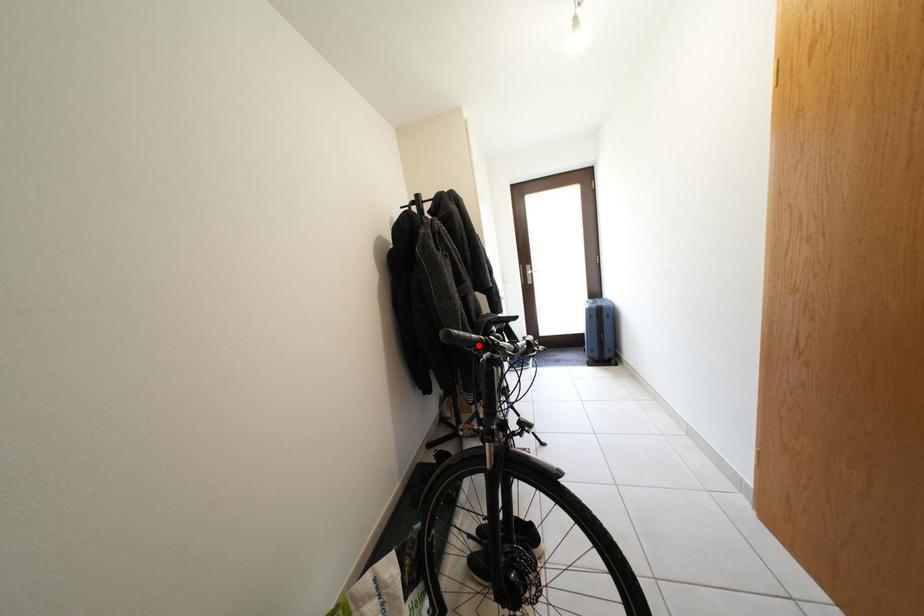
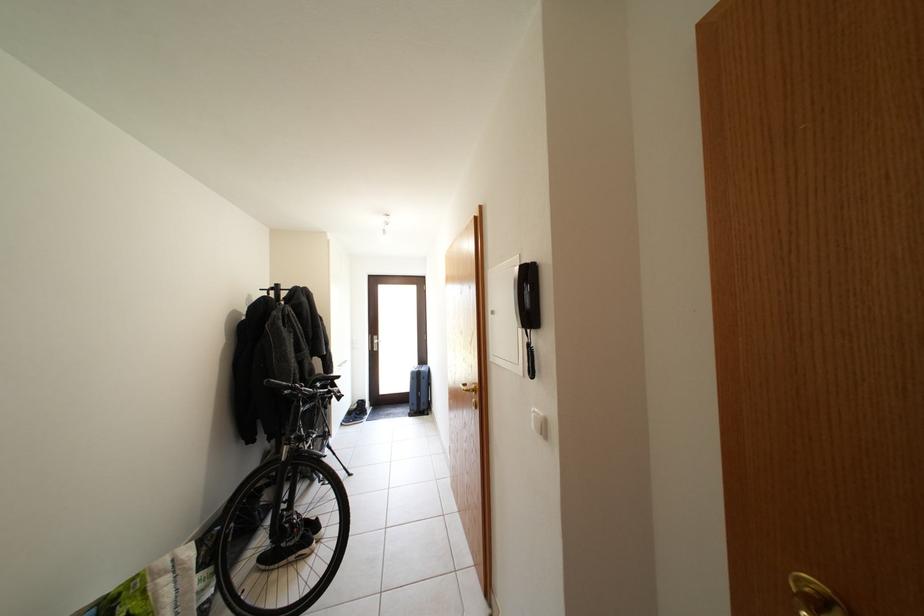
Question: I am providing you with two images of the same scene from different viewpoints. Image1 has a red point marked. In image2, the corresponding 3D location appears at what relative position? Reply with the corresponding letter.

Choices:
 (A) Closer
 (B) Farther

Answer: (A)